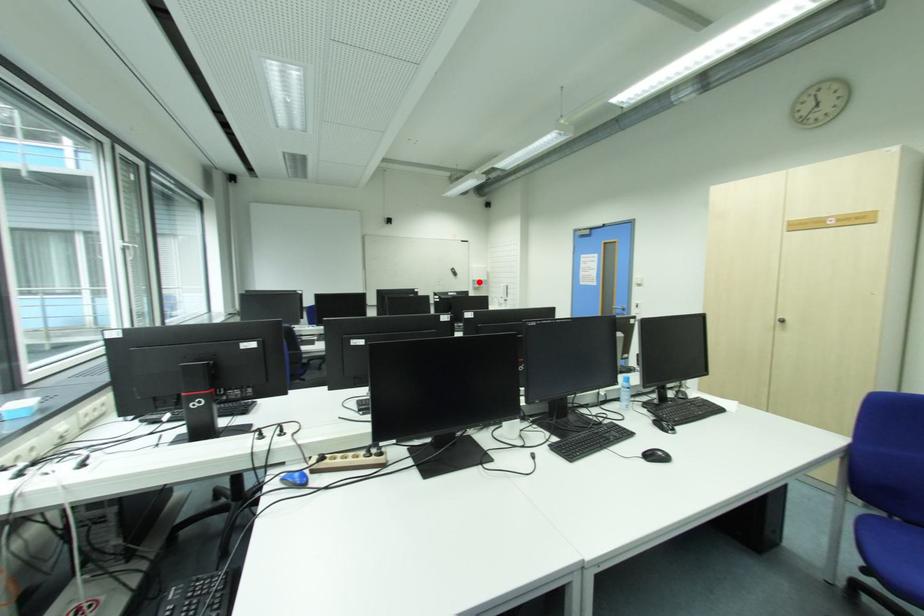
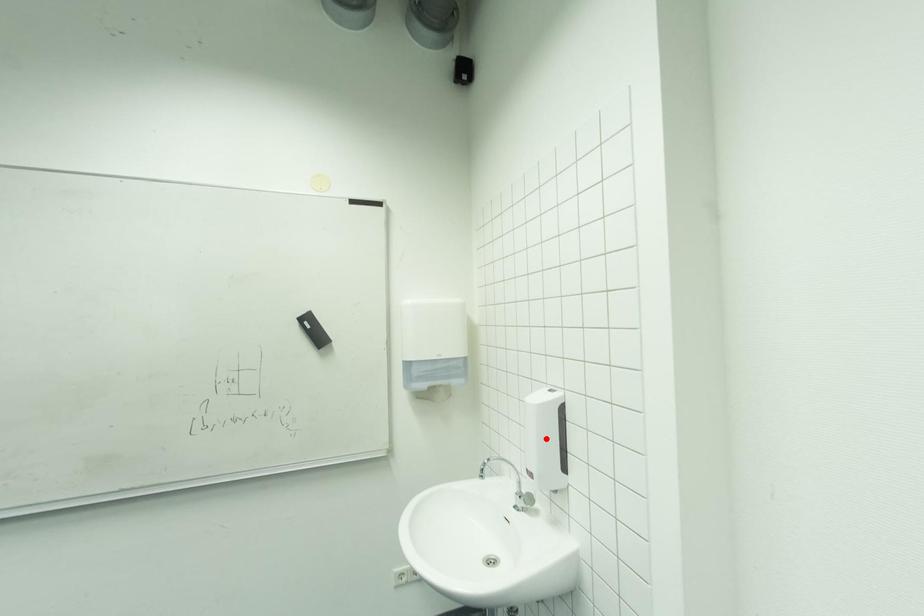
I am providing you with two images of the same scene from different viewpoints. A red point is marked on the first image and another point is marked on the second image. Are the points marked in image1 and image2 representing the same 3D position?

No